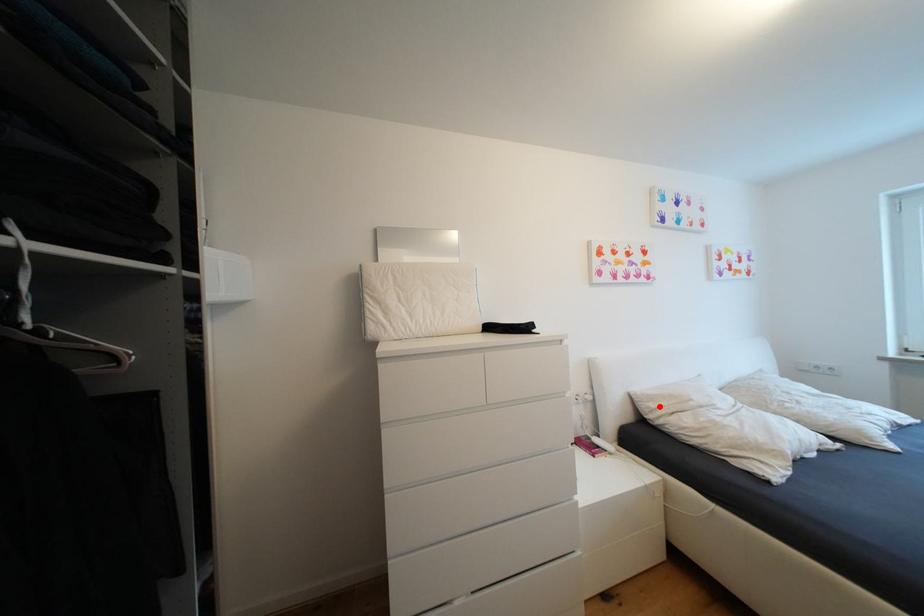
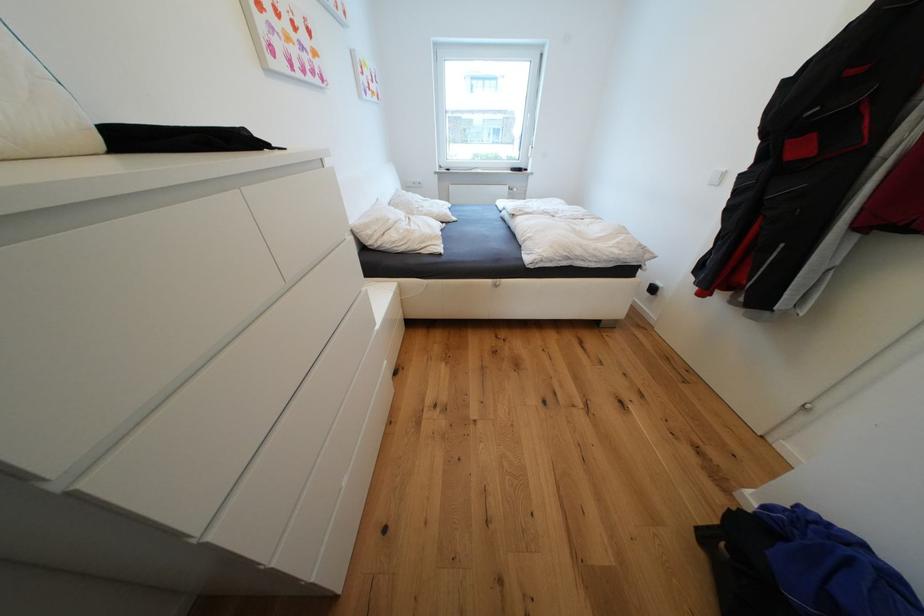
Find the pixel in the second image that matches the highlighted location in the first image.

(377, 233)